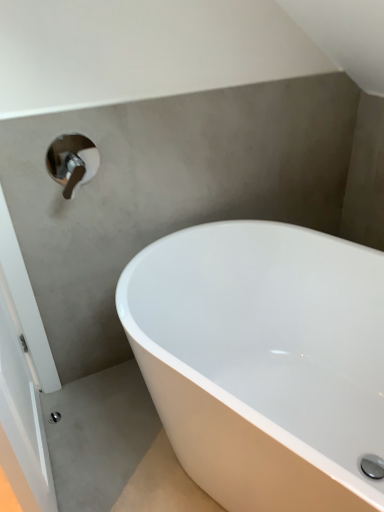
Question: Would you say white glossy bathtub at lower right is inside or outside satin nickel faucet at upper left?

Choices:
 (A) inside
 (B) outside

Answer: (B)

Question: In terms of height, does white glossy bathtub at lower right look taller or shorter compared to satin nickel faucet at upper left?

Choices:
 (A) short
 (B) tall

Answer: (B)

Question: From a real-world perspective, relative to satin nickel faucet at upper left, is white glossy bathtub at lower right vertically above or below?

Choices:
 (A) above
 (B) below

Answer: (B)

Question: Considering the positions of satin nickel faucet at upper left and white glossy bathtub at lower right in the image, is satin nickel faucet at upper left bigger or smaller than white glossy bathtub at lower right?

Choices:
 (A) big
 (B) small

Answer: (B)

Question: From their relative heights in the image, would you say satin nickel faucet at upper left is taller or shorter than white glossy bathtub at lower right?

Choices:
 (A) short
 (B) tall

Answer: (A)

Question: Visually, is satin nickel faucet at upper left positioned to the left or to the right of white glossy bathtub at lower right?

Choices:
 (A) left
 (B) right

Answer: (A)

Question: From the image's perspective, is satin nickel faucet at upper left above or below white glossy bathtub at lower right?

Choices:
 (A) above
 (B) below

Answer: (A)